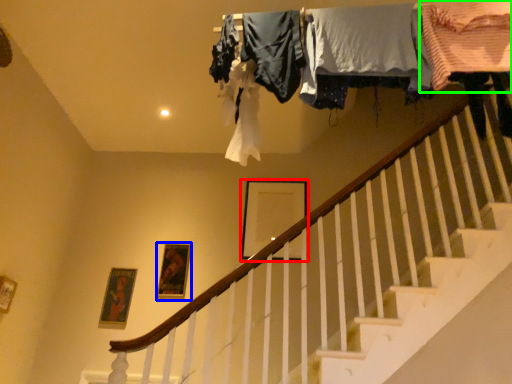
Question: Which object is the farthest from picture frame (highlighted by a red box)? Choose among these: picture frame (highlighted by a blue box) or clothing (highlighted by a green box).

Choices:
 (A) picture frame
 (B) clothing

Answer: (B)